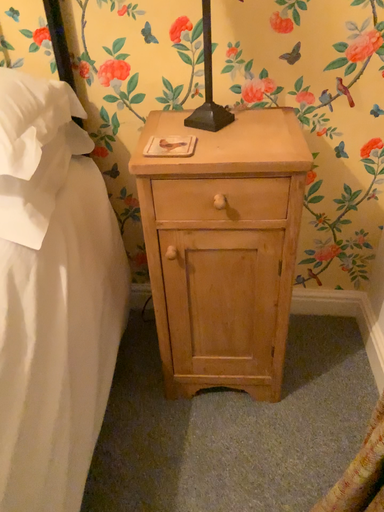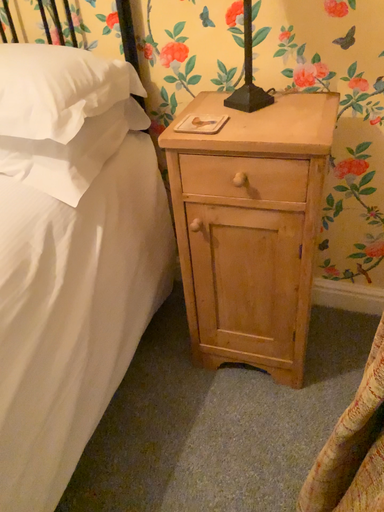
Question: How did the camera likely rotate when shooting the video?

Choices:
 (A) rotated left
 (B) rotated right

Answer: (A)